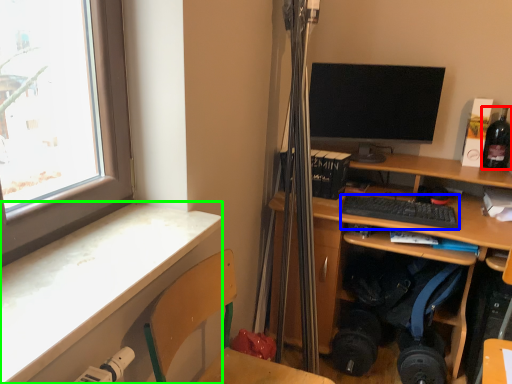
Question: Considering the real-world distances, which object is farthest from bottle (highlighted by a red box)? computer keyboard (highlighted by a blue box) or desk (highlighted by a green box)?

Choices:
 (A) computer keyboard
 (B) desk

Answer: (B)